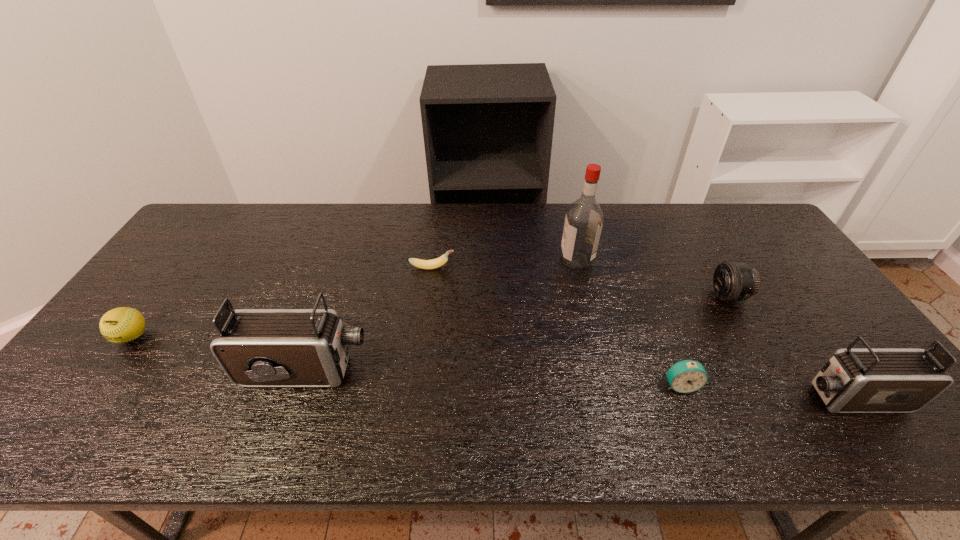
Find the location of a particular element. The width and height of the screenshot is (960, 540). free area in between the left camcorder and the third object from right to left is located at coordinates [x=492, y=378].

Identify the location of empty location between the fourth nearest object and the banana. Image resolution: width=960 pixels, height=540 pixels. (282, 302).

In order to click on free area in between the shorter camcorder and the telephoto lens in this screenshot , I will do `click(790, 347)`.

Locate an element on the screen. This screenshot has width=960, height=540. object that can be found as the sixth closest to the banana is located at coordinates (868, 380).

I want to click on object that stands as the fourth closest to the liquor, so click(868, 380).

You are a GUI agent. You are given a task and a screenshot of the screen. Output one action in this format:
    pyautogui.click(x=<x>, y=<y>)
    Task: Click on the free space that satisfies the following two spatial constraints: 1. on the front-facing side of the fifth nearest object; 2. on the logo side of the leftmost object
    Image resolution: width=960 pixels, height=540 pixels.
    Given the screenshot: What is the action you would take?
    [x=753, y=336]

The width and height of the screenshot is (960, 540). I want to click on vacant space that satisfies the following two spatial constraints: 1. on the front-facing side of the fourth object from left to right; 2. on the logo side of the fourth nearest object, so click(x=596, y=336).